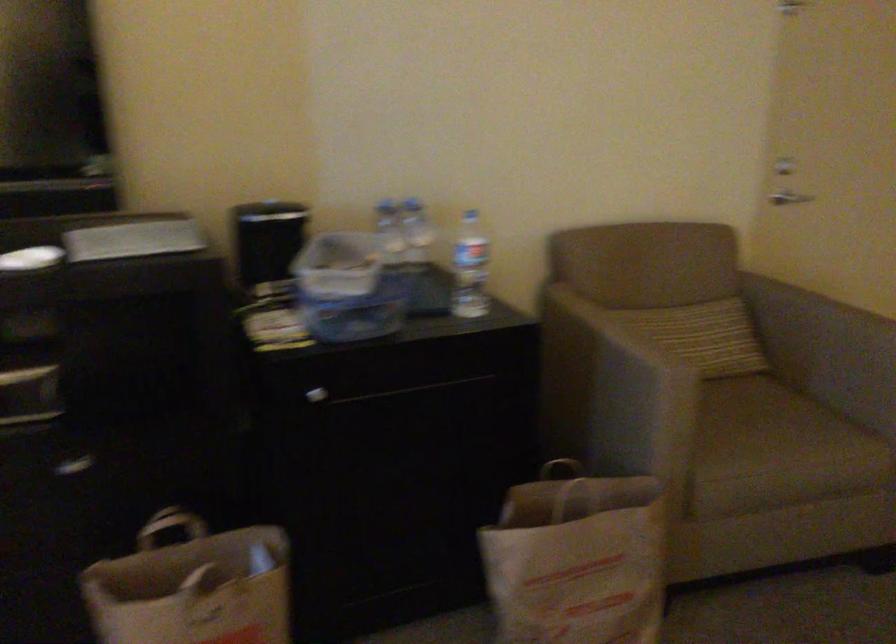
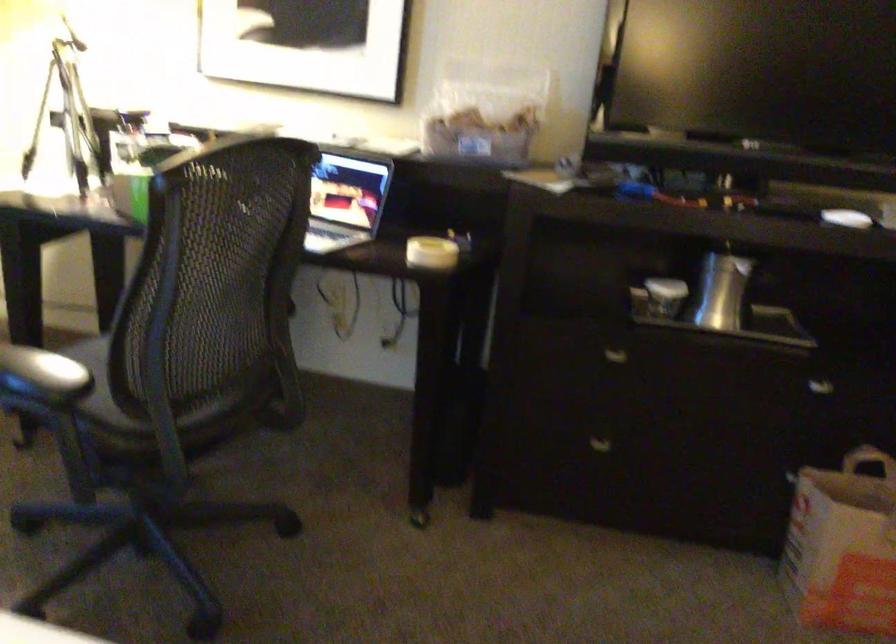
In the second image, find the point that corresponds to point 162,536 in the first image.

(867, 460)